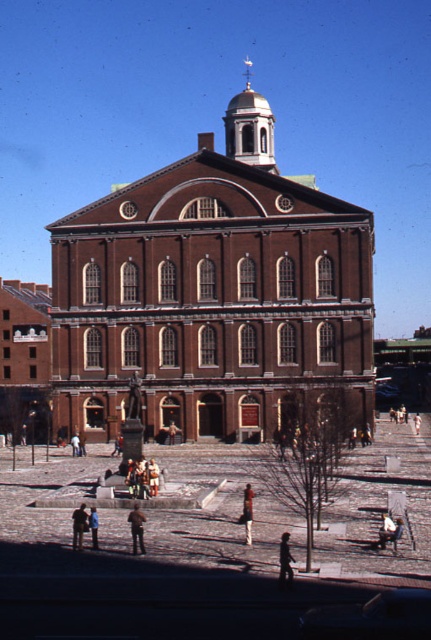
Question: Does light brown leather jacket at lower right have a greater width compared to light brown leather jacket at lower center?

Choices:
 (A) no
 (B) yes

Answer: (A)

Question: Is brown brick church at center to the left of light brown wooden statue at center from the viewer's perspective?

Choices:
 (A) no
 (B) yes

Answer: (A)

Question: Which point is closer to the camera taking this photo?

Choices:
 (A) (225, 426)
 (B) (417, 433)

Answer: (A)

Question: Which point is farther from the camera taking this photo?

Choices:
 (A) (x=156, y=468)
 (B) (x=80, y=540)
 (C) (x=287, y=550)
 (D) (x=252, y=211)

Answer: (D)

Question: Can you confirm if brown brick church at center is smaller than dark brown leather jacket at lower left?

Choices:
 (A) no
 (B) yes

Answer: (A)

Question: Which point is farther to the camera?

Choices:
 (A) (291, 572)
 (B) (78, 532)
 (C) (93, 515)

Answer: (C)